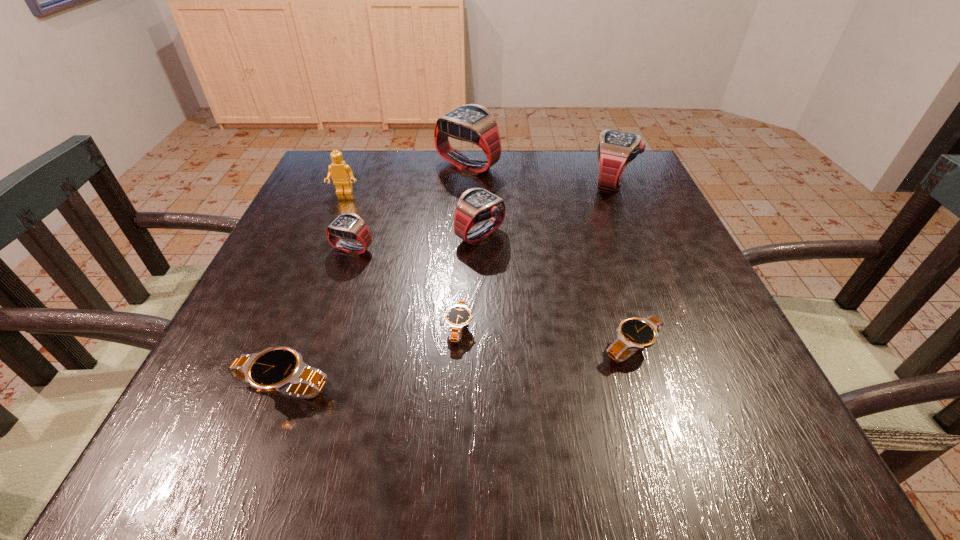
Image resolution: width=960 pixels, height=540 pixels. I want to click on the biggest red watch, so click(473, 123).

Identify the location of the tallest watch. The height and width of the screenshot is (540, 960). (473, 123).

Find the location of a particular element. the sixth shortest watch is located at coordinates (616, 150).

Find the location of `the rightmost red watch`. the rightmost red watch is located at coordinates (616, 150).

Locate an element on the screen. Lego is located at coordinates coord(342,175).

Locate an element on the screen. This screenshot has width=960, height=540. the third biggest red watch is located at coordinates (475, 205).

Locate an element on the screen. The width and height of the screenshot is (960, 540). the leftmost red watch is located at coordinates (348, 225).

At what (x,y) coordinates should I click in order to perform the action: click on the smallest red watch. Please return your answer as a coordinate pair (x, y). The image size is (960, 540). Looking at the image, I should click on (348, 225).

At what (x,y) coordinates should I click in order to perform the action: click on the third shortest watch. Please return your answer as a coordinate pair (x, y). Looking at the image, I should click on (280, 369).

You are a GUI agent. You are given a task and a screenshot of the screen. Output one action in this format:
    pyautogui.click(x=<x>, y=<y>)
    Task: Click on the biggest black watch
    The image size is (960, 540).
    Given the screenshot: What is the action you would take?
    pyautogui.click(x=280, y=369)